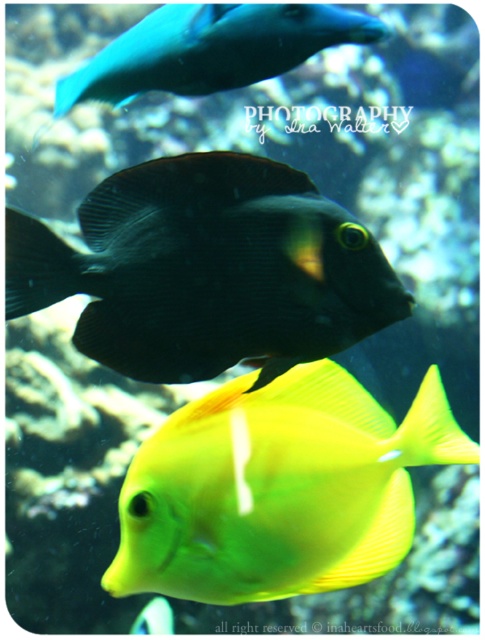
The image size is (485, 640). Identify the location of matte black fish at center. 208,269.

In the scene shown: Does matte black fish at center appear over shiny blue fish at upper center?

Incorrect, matte black fish at center is not positioned above shiny blue fish at upper center.

Does point (224, 260) lie in front of point (145, 17)?

That is True.

Image resolution: width=485 pixels, height=640 pixels. Identify the location of matte black fish at center. (208, 269).

This screenshot has width=485, height=640. Identify the location of matte black fish at center. (208, 269).

Which is more to the left, matte black fish at center or yellow matte fish at center?

From the viewer's perspective, matte black fish at center appears more on the left side.

Which is in front, point (268, 268) or point (452, 442)?

Point (268, 268)

The width and height of the screenshot is (485, 640). I want to click on matte black fish at center, so click(x=208, y=269).

Is point (249, 588) positioned after point (127, 52)?

No, it is in front of (127, 52).

Between yellow matte fish at center and shiny blue fish at upper center, which one is positioned lower?

Positioned lower is yellow matte fish at center.

At what (x,y) coordinates should I click in order to perform the action: click on yellow matte fish at center. Please return your answer as a coordinate pair (x, y). The image size is (485, 640). Looking at the image, I should click on (277, 488).